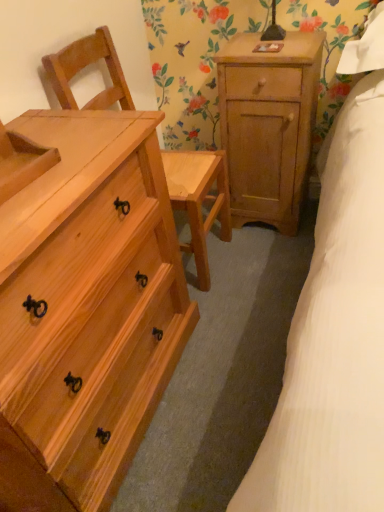
In order to click on vacant space in front of natural wood nightstand at upper right in this screenshot , I will do click(x=268, y=259).